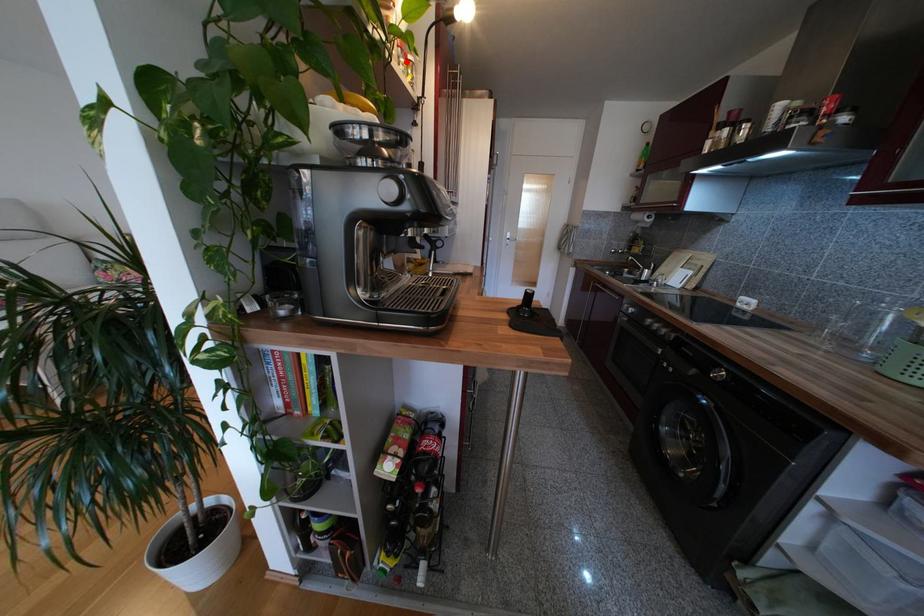
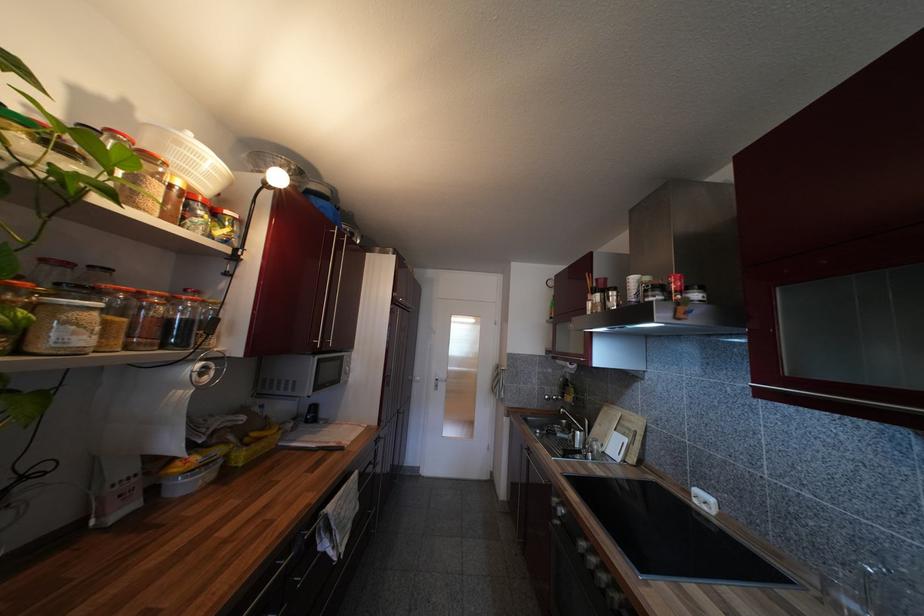
Find the pixel in the second image that matches the highlighted location in the first image.

(204, 215)